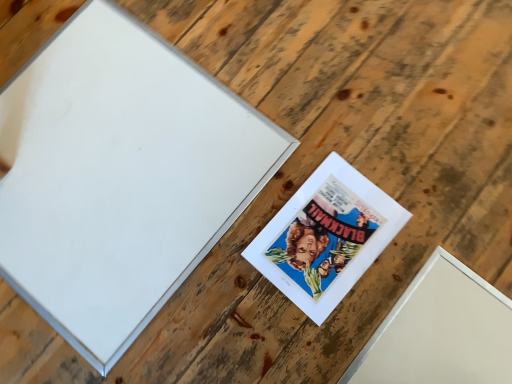
The height and width of the screenshot is (384, 512). I want to click on unoccupied region to the right of white matte picture frame at upper left, which is counted as the first picture frame, starting from the left, so click(x=350, y=153).